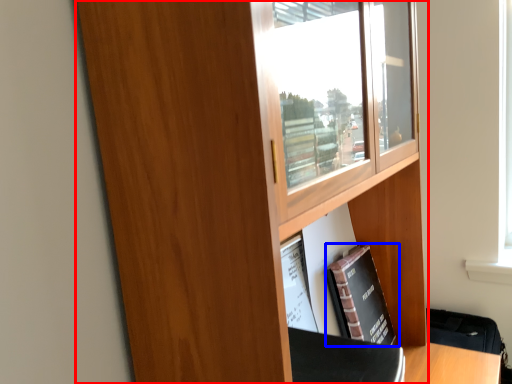
Question: Which object appears closest to the camera in this image, cupboard (highlighted by a red box) or book (highlighted by a blue box)?

Choices:
 (A) cupboard
 (B) book

Answer: (A)